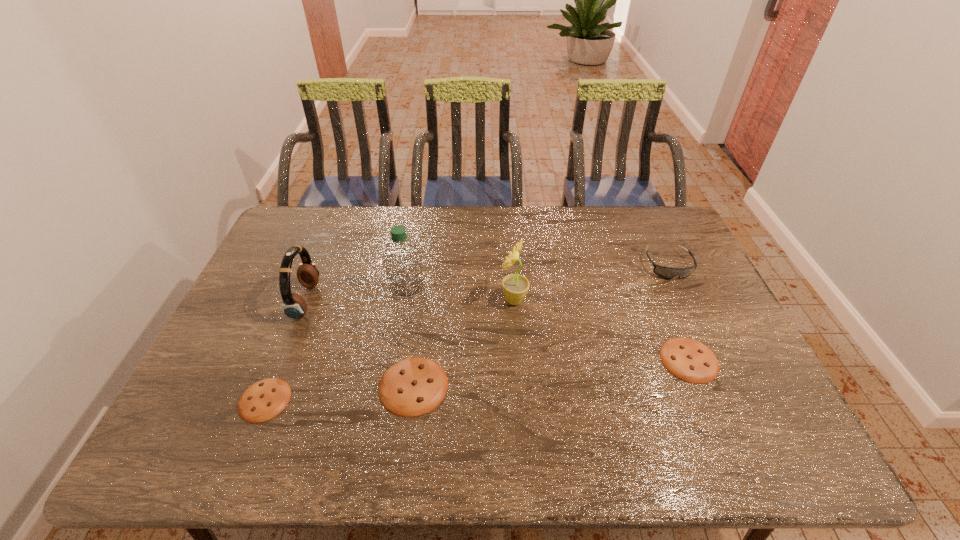
Identify the location of cookie that stands as the second closest to the second shortest object. (265, 399).

Locate an element on the screen. Image resolution: width=960 pixels, height=540 pixels. cookie that can be found as the third closest to the goggles is located at coordinates (265, 399).

At what (x,y) coordinates should I click in order to perform the action: click on vacant area in the image that satisfies the following two spatial constraints: 1. on the lenses of the fourth tallest object; 2. on the ear cup of the headset. Please return your answer as a coordinate pair (x, y). The image size is (960, 540). Looking at the image, I should click on (684, 301).

Find the location of a particular element. Image resolution: width=960 pixels, height=540 pixels. free space that satisfies the following two spatial constraints: 1. on the ear cup of the second cookie from right to left; 2. on the right side of the headset is located at coordinates (272, 386).

Locate an element on the screen. This screenshot has height=540, width=960. vacant area in the image that satisfies the following two spatial constraints: 1. on the ear cup of the third tallest object; 2. on the back side of the sixth tallest object is located at coordinates (282, 360).

You are a GUI agent. You are given a task and a screenshot of the screen. Output one action in this format:
    pyautogui.click(x=<x>, y=<y>)
    Task: Click on the free region that satisfies the following two spatial constraints: 1. on the back side of the second cookie from right to left; 2. on the ear cup of the fifth shortest object
    This screenshot has height=540, width=960.
    Given the screenshot: What is the action you would take?
    pyautogui.click(x=424, y=301)